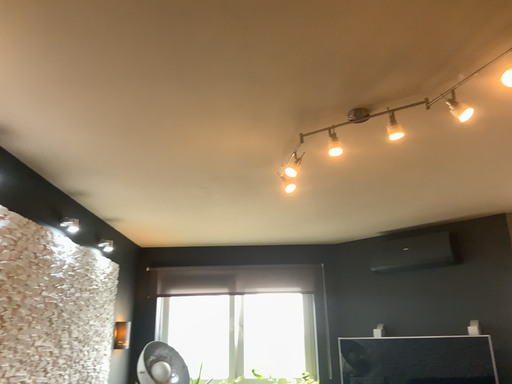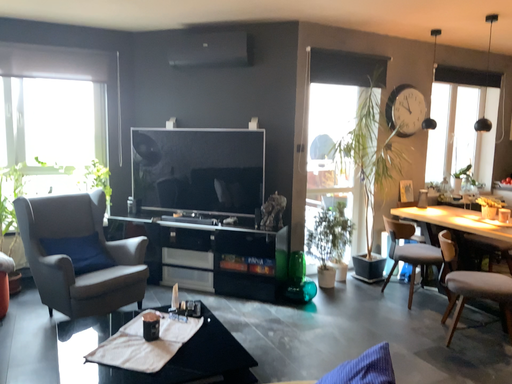
Question: Which way did the camera rotate in the video?

Choices:
 (A) rotated right
 (B) rotated left

Answer: (A)